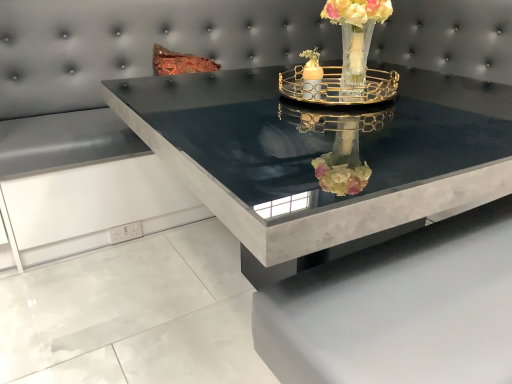
Question: Is matte glass candle holder at center, the first candle holder from the left, taller than black marble table at center?

Choices:
 (A) yes
 (B) no

Answer: (B)

Question: Considering the relative sizes of matte glass candle holder at center, the first candle holder from the left, and black marble table at center in the image provided, is matte glass candle holder at center, the first candle holder from the left, wider than black marble table at center?

Choices:
 (A) yes
 (B) no

Answer: (B)

Question: From a real-world perspective, is matte glass candle holder at center, the first candle holder from the left, under black marble table at center?

Choices:
 (A) no
 (B) yes

Answer: (A)

Question: Is matte glass candle holder at center, the second candle holder in the right-to-left sequence, oriented away from black marble table at center?

Choices:
 (A) yes
 (B) no

Answer: (B)

Question: From the image's perspective, is matte glass candle holder at center, the first candle holder from the left, under black marble table at center?

Choices:
 (A) no
 (B) yes

Answer: (A)

Question: Is gold metallic tray at center, marked as the 1th candle holder in a right-to-left arrangement, in front of or behind black marble table at center in the image?

Choices:
 (A) front
 (B) behind

Answer: (B)

Question: From their relative heights in the image, would you say gold metallic tray at center, marked as the 1th candle holder in a right-to-left arrangement, is taller or shorter than black marble table at center?

Choices:
 (A) tall
 (B) short

Answer: (B)

Question: Considering the positions of gold metallic tray at center, the second candle holder positioned from the left, and black marble table at center in the image, is gold metallic tray at center, the second candle holder positioned from the left, wider or thinner than black marble table at center?

Choices:
 (A) thin
 (B) wide

Answer: (A)

Question: Does point (313, 92) appear closer or farther from the camera than point (160, 107)?

Choices:
 (A) closer
 (B) farther

Answer: (A)

Question: Choose the correct answer: Is matte glass candle holder at center, the second candle holder in the right-to-left sequence, inside translucent glass vase at upper center or outside it?

Choices:
 (A) outside
 (B) inside

Answer: (B)

Question: Considering the positions of matte glass candle holder at center, the second candle holder in the right-to-left sequence, and translucent glass vase at upper center in the image, is matte glass candle holder at center, the second candle holder in the right-to-left sequence, bigger or smaller than translucent glass vase at upper center?

Choices:
 (A) big
 (B) small

Answer: (B)

Question: From their relative heights in the image, would you say matte glass candle holder at center, the first candle holder from the left, is taller or shorter than translucent glass vase at upper center?

Choices:
 (A) short
 (B) tall

Answer: (A)

Question: Looking at their shapes, would you say matte glass candle holder at center, the second candle holder in the right-to-left sequence, is wider or thinner than translucent glass vase at upper center?

Choices:
 (A) thin
 (B) wide

Answer: (A)

Question: Is point (313, 46) closer or farther from the camera than point (454, 162)?

Choices:
 (A) closer
 (B) farther

Answer: (B)

Question: From the image's perspective, relative to black marble table at center, is matte glass candle holder at center, the first candle holder from the left, above or below?

Choices:
 (A) above
 (B) below

Answer: (A)